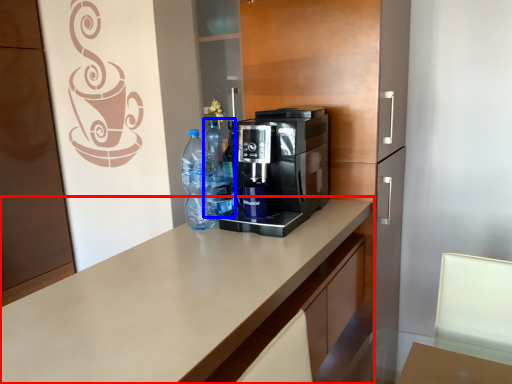
Question: Which object appears closest to the camera in this image, countertop (highlighted by a red box) or bottle (highlighted by a blue box)?

Choices:
 (A) countertop
 (B) bottle

Answer: (A)